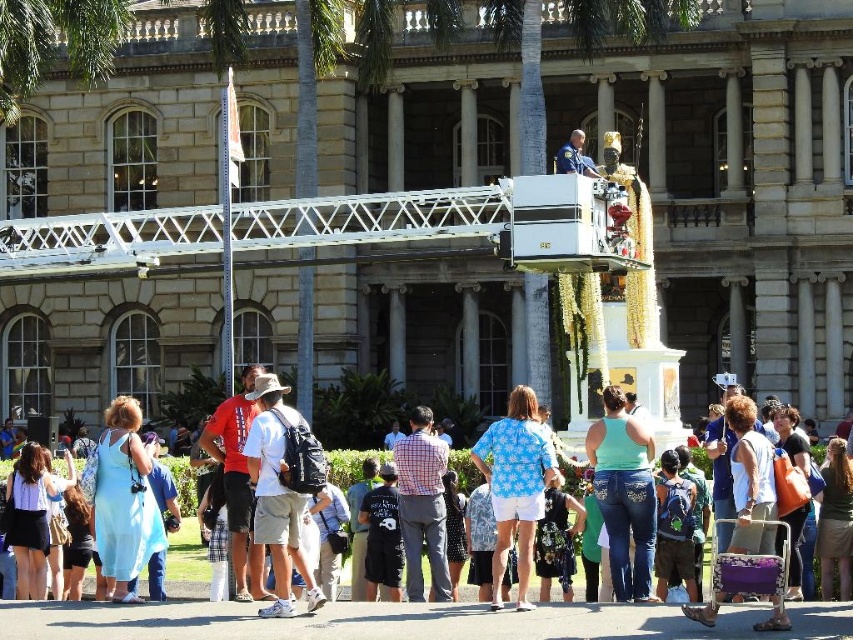
You are standing in front of the classical building and want to take a photo of both the point at coordinates (102, 483) and the point at coordinates (451, 560). Which point will appear larger in your photo?

Point at coordinates (102, 483) will appear larger in the photo because it is closer to the camera than point at coordinates (451, 560).

You are a photographer at the event and want to capture both the light blue fabric dress at lower left and the black printed dress at center in a single frame. Which dress should you focus on first to ensure both are in the shot?

The light blue fabric dress at lower left is above the black printed dress at center, so focusing on the light blue fabric dress at lower left first will ensure both dresses are captured in the frame.

You are a photographer trying to capture a shot of both the light blue fabric dress at lower left and the black printed dress at center. Which dress is located to the left of the other?

The light blue fabric dress at lower left is positioned on the left side of the black printed dress at center.